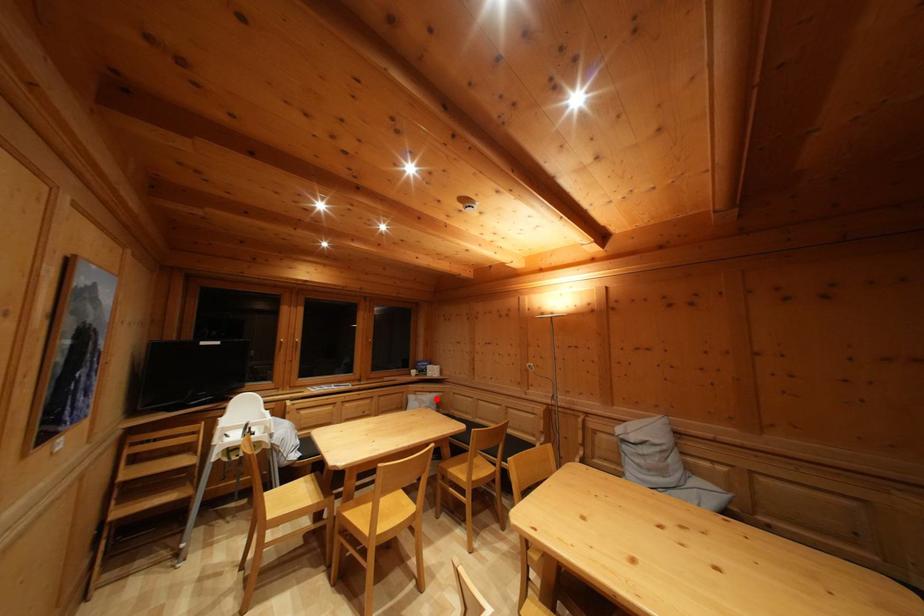
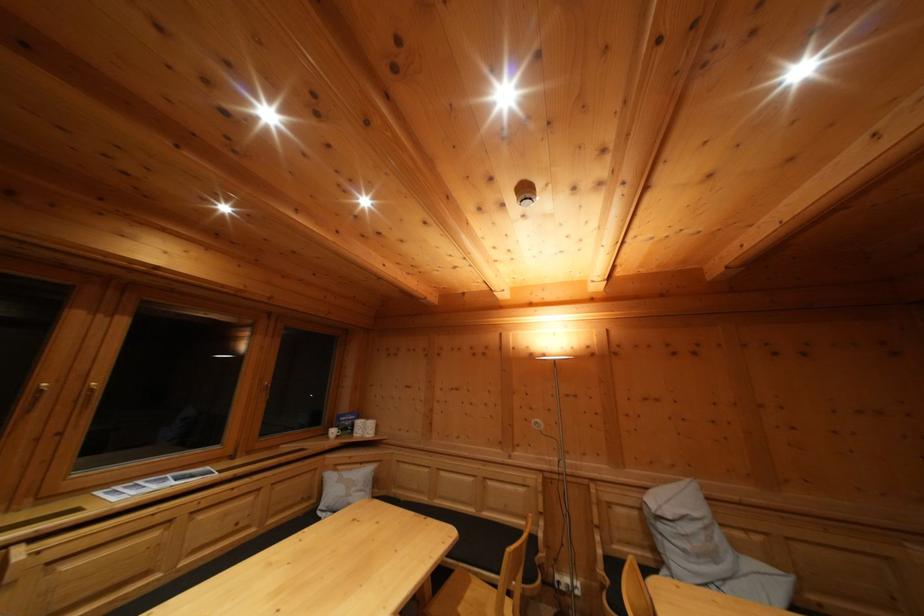
Find the pixel in the second image that matches the highlighted location in the first image.

(368, 469)